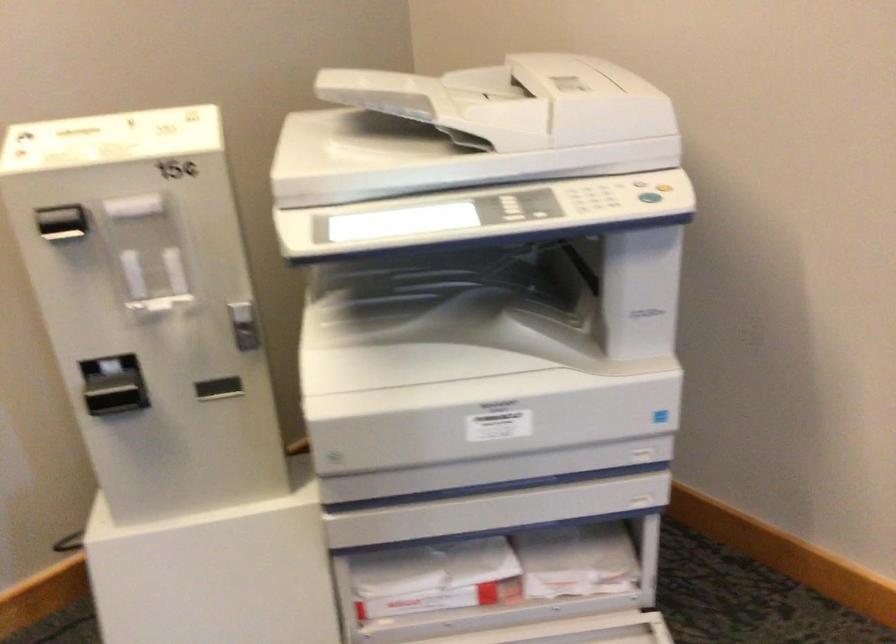
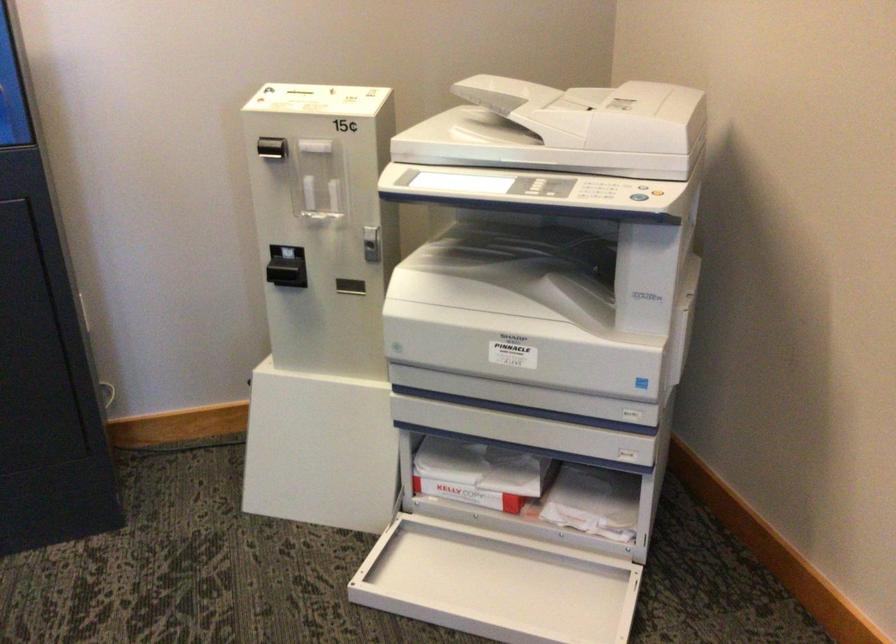
Where in the second image is the point corresponding to the point at 71,222 from the first image?

(271, 147)